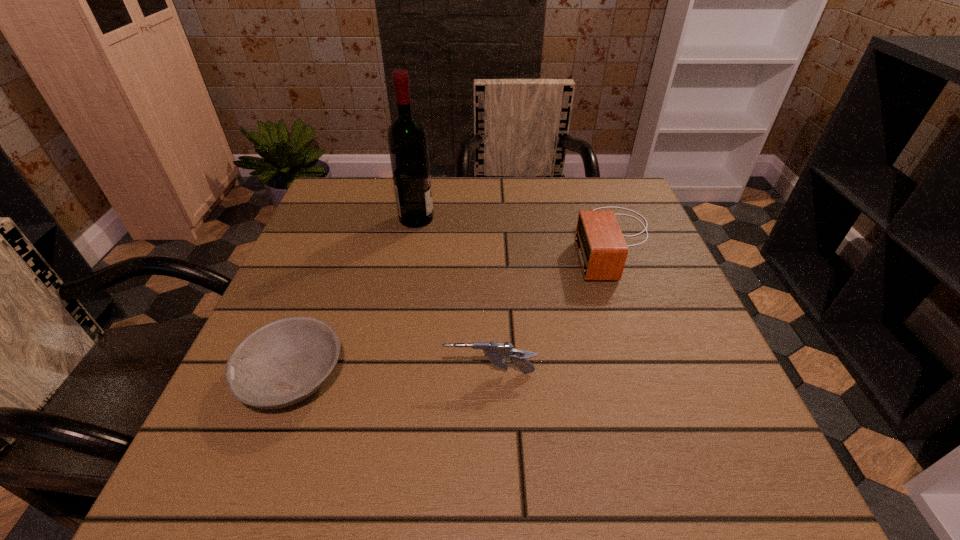
Identify the location of blank region between the tallest object and the radio receiver. This screenshot has width=960, height=540. (516, 230).

Where is `free space between the rightmost object and the alcohol`? free space between the rightmost object and the alcohol is located at coordinates (516, 230).

I want to click on vacant area between the alcohol and the radio receiver, so click(x=516, y=230).

Where is `free space that is in between the tallest object and the leftmost object`? free space that is in between the tallest object and the leftmost object is located at coordinates (354, 298).

What are the coordinates of `vacant point located between the second object from right to left and the third object from right to left` in the screenshot? It's located at pos(453,296).

Point out which object is positioned as the second nearest to the rightmost object. Please provide its 2D coordinates. Your answer should be formatted as a tuple, i.e. [(x, y)], where the tuple contains the x and y coordinates of a point satisfying the conditions above.

[(407, 139)]

Locate an element on the screen. object that ranks as the second closest to the gun is located at coordinates (602, 250).